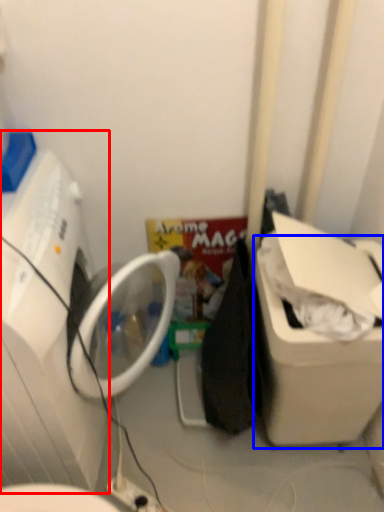
Question: Which point is further to the camera, washing machine (highlighted by a red box) or water cooler (highlighted by a blue box)?

Choices:
 (A) washing machine
 (B) water cooler

Answer: (B)